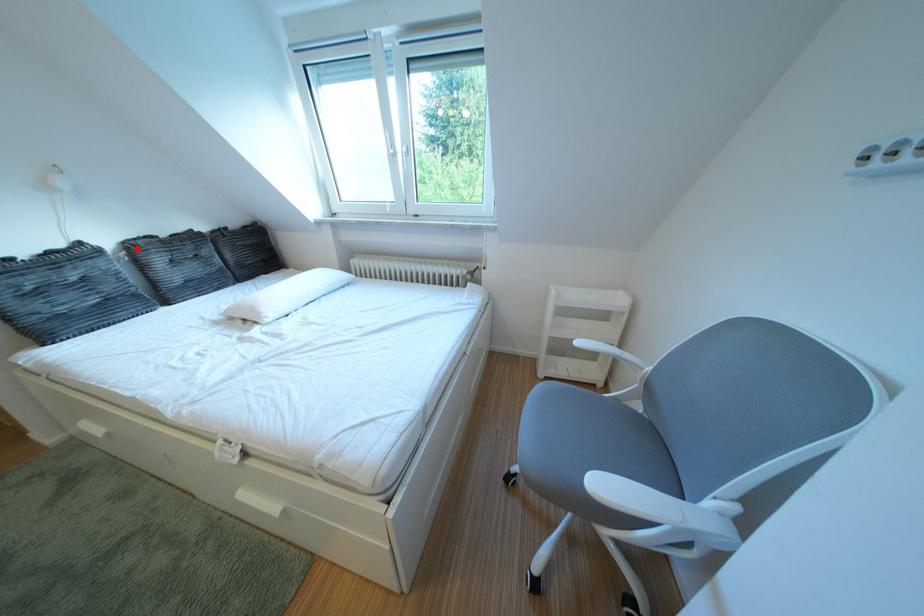
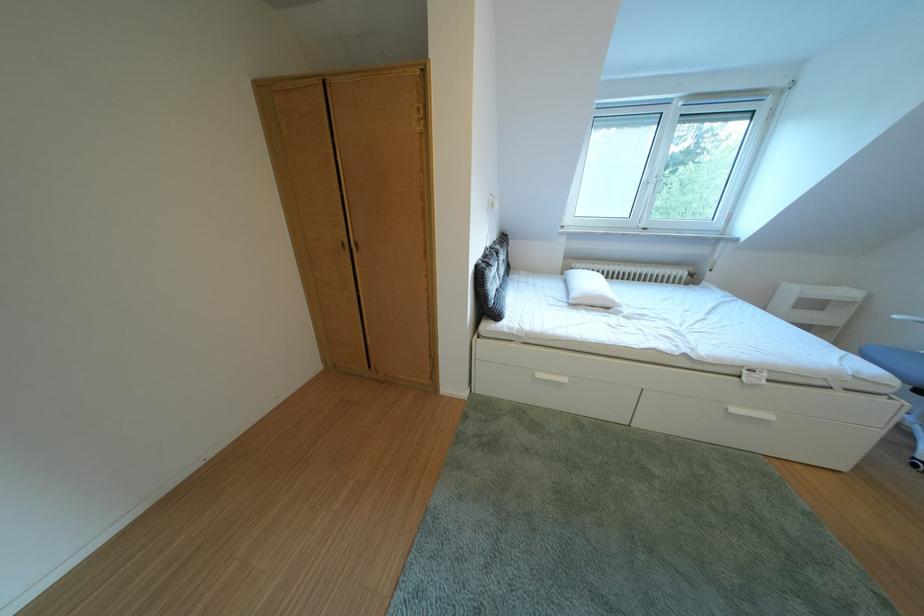
In the second image, find the point that corresponds to the highlighted location in the first image.

(505, 254)